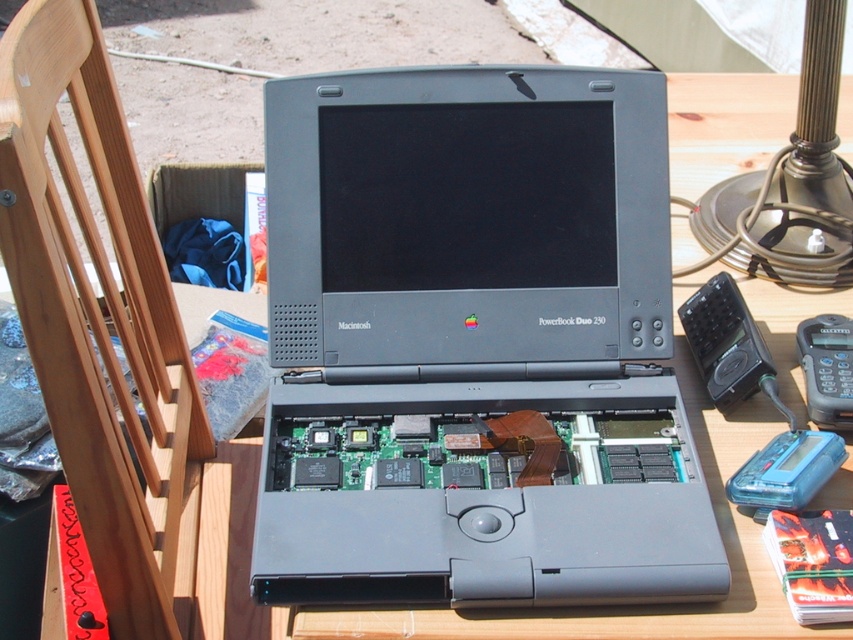
Question: Which object is closer to the camera taking this photo?

Choices:
 (A) polished brass lamp at upper right
 (B) wooden at left

Answer: (B)

Question: Is wooden at left to the left of polished brass lamp at upper right from the viewer's perspective?

Choices:
 (A) no
 (B) yes

Answer: (B)

Question: Among these points, which one is nearest to the camera?

Choices:
 (A) (820, 195)
 (B) (838, 413)
 (C) (74, 376)

Answer: (C)

Question: Does matte gray laptop at center have a lesser width compared to wooden at left?

Choices:
 (A) yes
 (B) no

Answer: (B)

Question: Does wooden at left come in front of black plastic phone at right?

Choices:
 (A) no
 (B) yes

Answer: (B)

Question: Which point is farther from the camera taking this photo?

Choices:
 (A) (97, 317)
 (B) (822, 396)
 (C) (669, 387)
 (D) (807, 40)

Answer: (D)